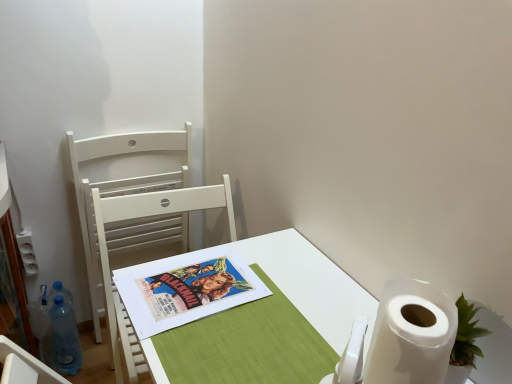
Image resolution: width=512 pixels, height=384 pixels. Find the location of `vacant point above white paper desk at center (from a real-world perspective)`. vacant point above white paper desk at center (from a real-world perspective) is located at coordinates (255, 302).